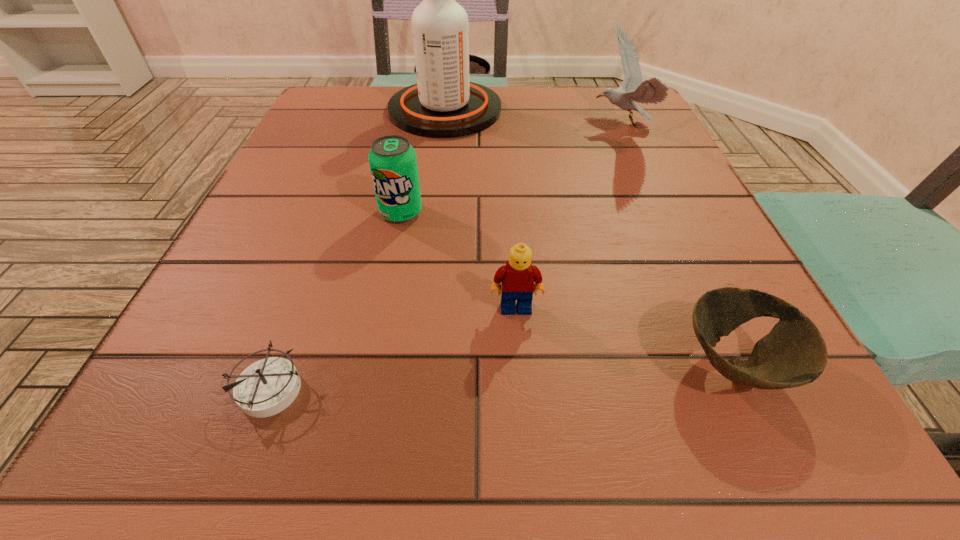
Locate an element on the screen. This screenshot has width=960, height=540. the tallest object is located at coordinates (443, 104).

The image size is (960, 540). In order to click on gull in this screenshot , I will do `click(652, 91)`.

At what (x,y) coordinates should I click in order to perform the action: click on the third farthest object. Please return your answer as a coordinate pair (x, y). This screenshot has width=960, height=540. Looking at the image, I should click on (393, 164).

Where is `the third nearest object`? The height and width of the screenshot is (540, 960). the third nearest object is located at coordinates 518,276.

Locate an element on the screen. This screenshot has height=540, width=960. the second shortest object is located at coordinates (794, 353).

Find the location of a particular element. compass is located at coordinates (268, 386).

Identify the location of vacant region located on the right of the cleansing agent. The height and width of the screenshot is (540, 960). (541, 110).

The image size is (960, 540). Find the location of `vacant region located 0.100m at the tip of the beak of the second tallest object`. vacant region located 0.100m at the tip of the beak of the second tallest object is located at coordinates (544, 126).

Locate an element on the screen. Image resolution: width=960 pixels, height=540 pixels. vacant point located 0.320m at the tip of the beak of the second tallest object is located at coordinates (441, 126).

Where is `free space located 0.140m at the tip of the beak of the second tallest object`? free space located 0.140m at the tip of the beak of the second tallest object is located at coordinates (525, 126).